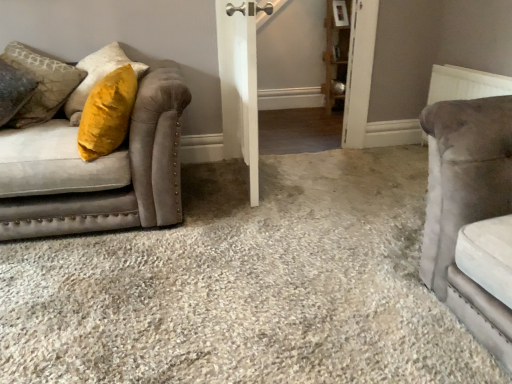
Where is `white textured radiator at upper right`? white textured radiator at upper right is located at coordinates (465, 84).

At what (x,y) coordinates should I click in order to perform the action: click on wooden shelf at upper right. Please return your answer as a coordinate pair (x, y). Image resolution: width=512 pixels, height=384 pixels. Looking at the image, I should click on (336, 53).

Find the location of a particular element. This screenshot has width=512, height=384. white wooden barn door at center is located at coordinates (240, 84).

At what (x,y) coordinates should I click in order to perform the action: click on white textured radiator at upper right. Please return your answer as a coordinate pair (x, y). Image resolution: width=512 pixels, height=384 pixels. Looking at the image, I should click on (465, 84).

Are velvet gray couch at left and white textured radiator at upper right beside each other?

No.

Would you say velvet gray couch at left is inside or outside white textured radiator at upper right?

velvet gray couch at left is located beyond the bounds of white textured radiator at upper right.

Which is more to the right, velvet gray couch at left or white textured radiator at upper right?

white textured radiator at upper right.

From the image's perspective, which one is positioned higher, velvet gray couch at left or white textured radiator at upper right?

white textured radiator at upper right, from the image's perspective.

Is velvet gray couch at left closer to camera compared to white wooden barn door at center?

Yes, velvet gray couch at left is in front of white wooden barn door at center.

Is velvet gray couch at left far away from white wooden barn door at center?

They are positioned close to each other.

Is velvet gray couch at left inside or outside of white wooden barn door at center?

velvet gray couch at left is not inside white wooden barn door at center, it's outside.

Considering the points (16, 169) and (249, 183), which point is behind, point (16, 169) or point (249, 183)?

The point (249, 183) is more distant.

Looking at their sizes, would you say white textured radiator at upper right is wider or thinner than velvet gray couch at left?

Clearly, white textured radiator at upper right has less width compared to velvet gray couch at left.

Is point (508, 89) closer or farther from the camera than point (159, 109)?

Point (508, 89) appears to be farther away from the viewer than point (159, 109).

Is white textured radiator at upper right far from velvet gray couch at left?

Yes, white textured radiator at upper right is far from velvet gray couch at left.

Is velvet gray couch at left located within white textured radiator at upper right?

No, white textured radiator at upper right does not contain velvet gray couch at left.

Which is further, (338,106) or (155,120)?

The point (338,106) is farther.

Would you say wooden shelf at upper right is outside velvet gray couch at left?

Yes.

In the scene shown: Is wooden shelf at upper right turned away from velvet gray couch at left?

No.

Can you confirm if wooden shelf at upper right is thinner than white wooden barn door at center?

Incorrect, the width of wooden shelf at upper right is not less than that of white wooden barn door at center.

Who is more distant, wooden shelf at upper right or white wooden barn door at center?

Positioned behind is wooden shelf at upper right.

Considering the relative sizes of wooden shelf at upper right and white wooden barn door at center in the image provided, is wooden shelf at upper right shorter than white wooden barn door at center?

No, wooden shelf at upper right is not shorter than white wooden barn door at center.

Can you confirm if wooden shelf at upper right is positioned to the right of white textured radiator at upper right?

In fact, wooden shelf at upper right is to the left of white textured radiator at upper right.

Could you tell me if wooden shelf at upper right is facing white textured radiator at upper right?

Yes, wooden shelf at upper right is facing white textured radiator at upper right.

Which is closer to the camera, (334, 46) or (439, 66)?

Point (439, 66)

Which of these two, wooden shelf at upper right or white textured radiator at upper right, is bigger?

wooden shelf at upper right.

In the scene shown: From the image's perspective, is wooden shelf at upper right under velvet yellow pillow at left?

Incorrect, from the image's perspective, wooden shelf at upper right is higher than velvet yellow pillow at left.

Looking at the image, does wooden shelf at upper right seem bigger or smaller compared to velvet yellow pillow at left?

In the image, wooden shelf at upper right appears to be larger than velvet yellow pillow at left.

At what (x,y) coordinates should I click in order to perform the action: click on pillow in front of the wooden shelf at upper right. Please return your answer as a coordinate pair (x, y). Looking at the image, I should click on (41, 83).

The image size is (512, 384). Find the location of `radiator beneath the velvet gray couch at left (from a real-world perspective)`. radiator beneath the velvet gray couch at left (from a real-world perspective) is located at coordinates (465, 84).

The height and width of the screenshot is (384, 512). Identify the location of barn door above the velvet gray couch at left (from a real-world perspective). (240, 84).

Which object lies further to the anchor point velvet yellow pillow at left, white textured radiator at upper right or white wooden barn door at center?

white textured radiator at upper right is positioned further to the anchor velvet yellow pillow at left.

Estimate the real-world distances between objects in this image. Which object is further from velvet yellow pillow at left, velvet gray couch at left or white wooden barn door at center?

white wooden barn door at center is positioned further to the anchor velvet yellow pillow at left.

From the picture: Based on their spatial positions, is velvet gray couch at left or white textured radiator at upper right closer to wooden shelf at upper right?

Among the two, white textured radiator at upper right is located nearer to wooden shelf at upper right.

Estimate the real-world distances between objects in this image. Which object is closer to velvet gray couch at left, white textured radiator at upper right or white wooden barn door at center?

white wooden barn door at center is closer to velvet gray couch at left.

Looking at the image, which one is located further to white textured radiator at upper right, velvet gray couch at left or white wooden barn door at center?

Among the two, velvet gray couch at left is located further to white textured radiator at upper right.

Based on their spatial positions, is wooden shelf at upper right or velvet gray couch at left further from white wooden barn door at center?

wooden shelf at upper right lies further to white wooden barn door at center than the other object.

From the image, which object appears to be nearer to velvet yellow pillow at left, white wooden barn door at center or velvet gray couch at left?

velvet gray couch at left is closer to velvet yellow pillow at left.

From the image, which object appears to be nearer to wooden shelf at upper right, velvet yellow pillow at left or velvet gray couch at left?

velvet gray couch at left is closer to wooden shelf at upper right.

Where is `shelf between velvet yellow pillow at left and white textured radiator at upper right in the horizontal direction`? The image size is (512, 384). shelf between velvet yellow pillow at left and white textured radiator at upper right in the horizontal direction is located at coordinates (336, 53).

Locate an element on the screen. The height and width of the screenshot is (384, 512). barn door between velvet gray couch at left and wooden shelf at upper right in the front-back direction is located at coordinates (240, 84).

Locate an element on the screen. This screenshot has width=512, height=384. radiator between white wooden barn door at center and wooden shelf at upper right in the front-back direction is located at coordinates click(x=465, y=84).

I want to click on shelf between velvet gray couch at left and white textured radiator at upper right, so click(x=336, y=53).